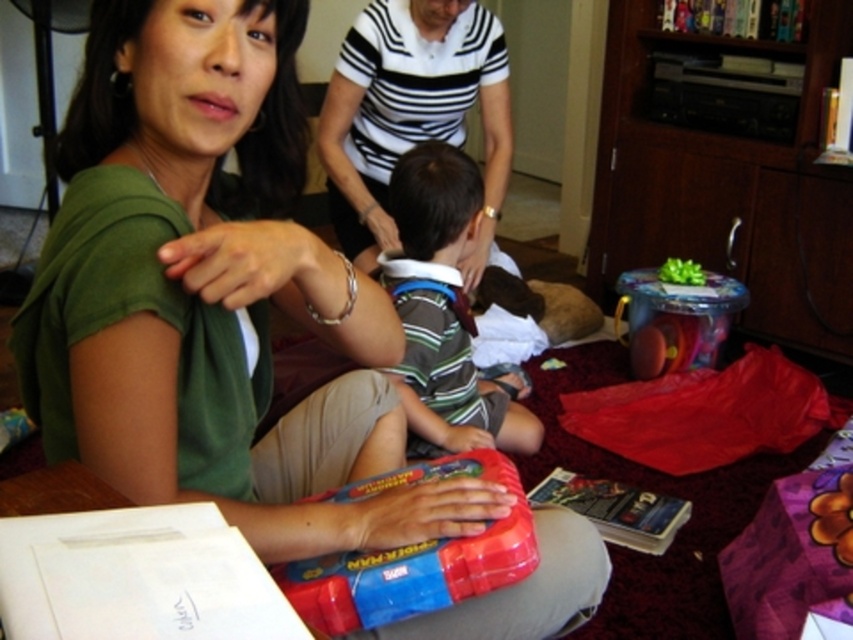
Which is below, green matte shirt at center or shiny plastic toy at center?

Positioned lower is shiny plastic toy at center.

Looking at this image, between green matte shirt at center and shiny plastic toy at center, which one appears on the right side from the viewer's perspective?

Positioned to the right is shiny plastic toy at center.

Describe the element at coordinates (212, 292) in the screenshot. Image resolution: width=853 pixels, height=640 pixels. I see `green matte shirt at center` at that location.

I want to click on green matte shirt at center, so click(x=212, y=292).

Does striped fabric shirt at center have a greater height compared to shiny plastic toy at center?

Yes.

Does striped fabric shirt at center have a smaller size compared to shiny plastic toy at center?

No.

Who is more forward, (527, 448) or (489, 458)?

Point (489, 458) is more forward.

The image size is (853, 640). I want to click on striped fabric shirt at center, so click(444, 312).

Does shiny plastic toy at center have a lesser height compared to shiny metallic drum at center?

Indeed, shiny plastic toy at center has a lesser height compared to shiny metallic drum at center.

What do you see at coordinates (413, 556) in the screenshot? The width and height of the screenshot is (853, 640). I see `shiny plastic toy at center` at bounding box center [413, 556].

Locate an element on the screen. Image resolution: width=853 pixels, height=640 pixels. shiny plastic toy at center is located at coordinates (413, 556).